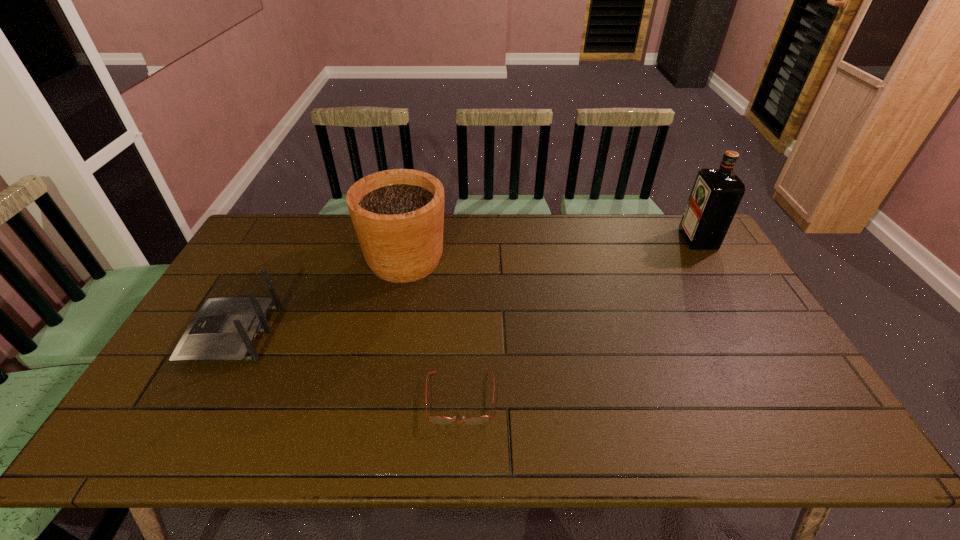
Locate an element on the screen. This screenshot has height=540, width=960. free space located on the left of the flowerpot is located at coordinates (335, 260).

This screenshot has height=540, width=960. I want to click on liquor situated at the far edge, so click(716, 194).

Find the location of a particular element. This screenshot has width=960, height=540. flowerpot present at the far edge is located at coordinates (398, 215).

You are a GUI agent. You are given a task and a screenshot of the screen. Output one action in this format:
    pyautogui.click(x=<x>, y=<y>)
    Task: Click on the object that is positioned at the near edge
    
    Given the screenshot: What is the action you would take?
    pyautogui.click(x=436, y=419)

You are a GUI agent. You are given a task and a screenshot of the screen. Output one action in this format:
    pyautogui.click(x=<x>, y=<y>)
    Task: Click on the object located at the left edge
    Image resolution: width=960 pixels, height=540 pixels.
    Given the screenshot: What is the action you would take?
    pyautogui.click(x=225, y=329)

Locate an element on the screen. object that is positioned at the right edge is located at coordinates (716, 194).

The width and height of the screenshot is (960, 540). Find the location of `object at the far right corner`. object at the far right corner is located at coordinates (716, 194).

The height and width of the screenshot is (540, 960). What are the coordinates of `vacant region at the far edge of the desktop` in the screenshot? It's located at (549, 232).

In the image, there is a desktop. Where is `vacant space at the near edge`? vacant space at the near edge is located at coordinates (587, 438).

Identify the location of vacant region at the left edge. point(201,389).